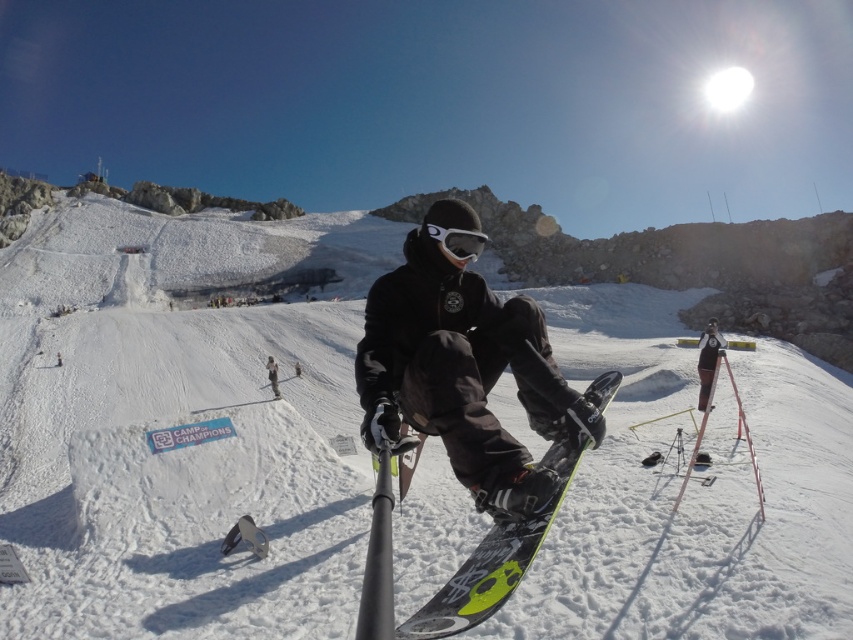
Who is lower down, white matte snowboard at center or neon yellow matte snowboard at center?

neon yellow matte snowboard at center

The height and width of the screenshot is (640, 853). I want to click on white matte snowboard at center, so click(x=181, y=422).

Which is in front, point (664, 380) or point (582, 442)?

Point (582, 442)

I want to click on white matte snowboard at center, so click(181, 422).

Is white matte snowboard at center shorter than black matte snowboarder at center?

In fact, white matte snowboard at center may be taller than black matte snowboarder at center.

Does point (753, 364) come closer to viewer compared to point (383, 285)?

No, (753, 364) is behind (383, 285).

At what (x,y) coordinates should I click in order to perform the action: click on white matte snowboard at center. Please return your answer as a coordinate pair (x, y). Looking at the image, I should click on (181, 422).

Does black matte snowboarder at center appear on the left side of white matte goggles at center?

Yes, black matte snowboarder at center is to the left of white matte goggles at center.

You are a GUI agent. You are given a task and a screenshot of the screen. Output one action in this format:
    pyautogui.click(x=<x>, y=<y>)
    Task: Click on the black matte snowboarder at center
    
    Given the screenshot: What is the action you would take?
    pyautogui.click(x=463, y=371)

At what (x,y) coordinates should I click in order to perform the action: click on black matte snowboarder at center. Please return your answer as a coordinate pair (x, y). The height and width of the screenshot is (640, 853). Looking at the image, I should click on (463, 371).